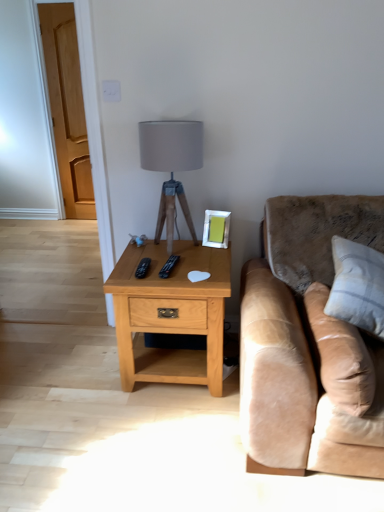
The image size is (384, 512). In order to click on free point to the left of black plastic remote at center in this screenshot , I will do (x=135, y=272).